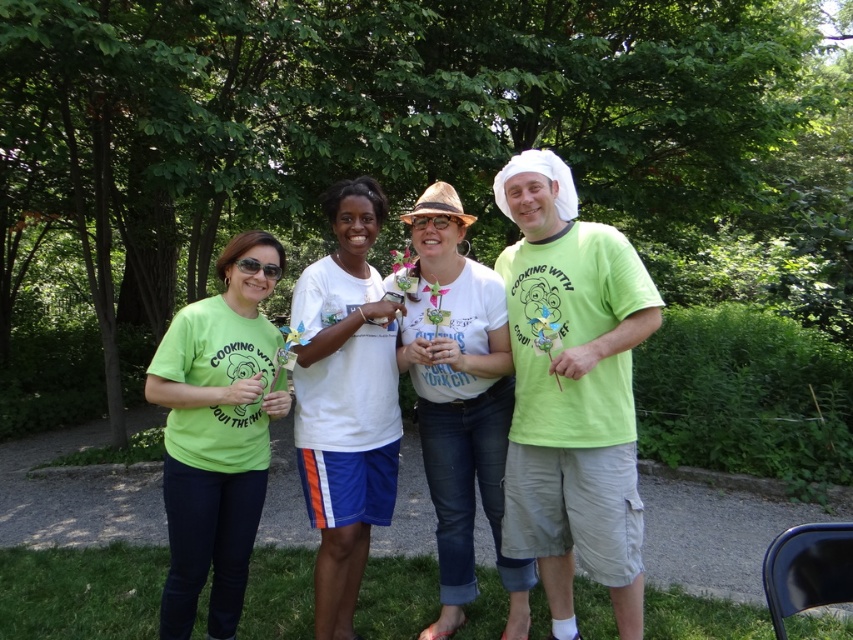
You are standing at the origin point in the image. Which of the two points, point (612, 269) or point (590, 516), is closer to you?

Point (612, 269) is in front of point (590, 516), so it is closer to you.

You are a photographer trying to capture a group photo of the four individuals in the scene. You notice the white cotton shirt at center and the white matte hat at center. Which object should you adjust to ensure the hat is visible in the photo?

The white cotton shirt at center is taller than the white matte hat at center. To ensure the hat is visible, you should lower the white cotton shirt at center so it doesn